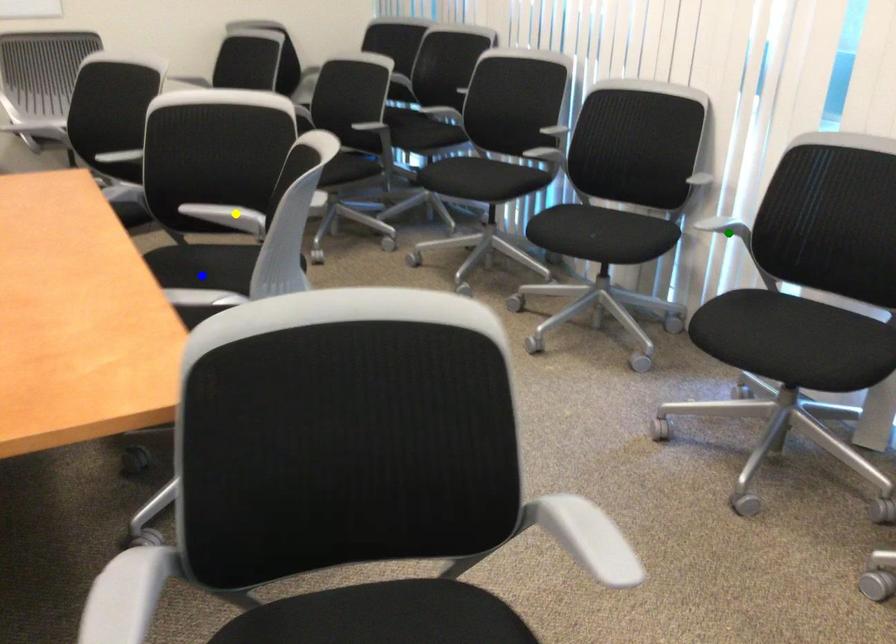
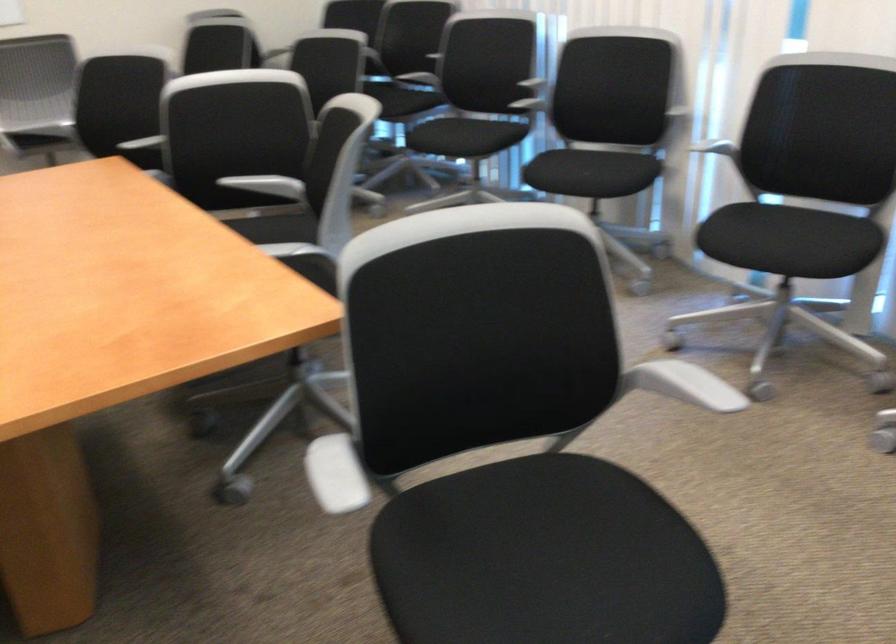
I am providing you with two images of the same scene from different viewpoints. Three points are marked in image1. Which point corresponds to a part or object that is occluded in image2?In image1, three points are marked. Which of them correspond to a part or object that is occluded in image2?Among the three points shown in image1, which one corresponds to a part or object that is no longer visible due to occlusion in image2?

blue point